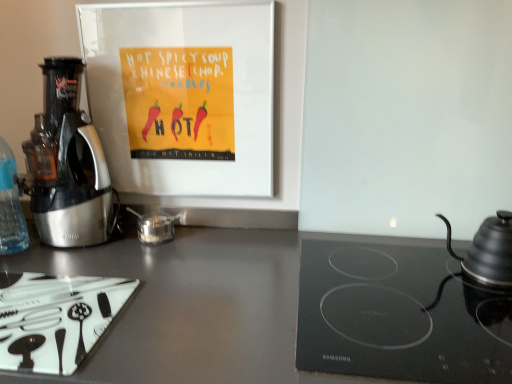
Question: From a real-world perspective, is metallic silver coffee maker at left located higher than white glossy cutting board at lower left, the second kitchen appliance viewed from the right?

Choices:
 (A) no
 (B) yes

Answer: (B)

Question: From the image's perspective, would you say metallic silver coffee maker at left is positioned over white glossy cutting board at lower left, marked as the first kitchen appliance in a left-to-right arrangement?

Choices:
 (A) no
 (B) yes

Answer: (B)

Question: Can you confirm if metallic silver coffee maker at left is positioned to the left of white glossy cutting board at lower left, marked as the first kitchen appliance in a left-to-right arrangement?

Choices:
 (A) no
 (B) yes

Answer: (B)

Question: Is there a large distance between metallic silver coffee maker at left and white glossy cutting board at lower left, the second kitchen appliance viewed from the right?

Choices:
 (A) yes
 (B) no

Answer: (B)

Question: Is the depth of metallic silver coffee maker at left greater than that of white glossy cutting board at lower left, marked as the first kitchen appliance in a left-to-right arrangement?

Choices:
 (A) no
 (B) yes

Answer: (B)

Question: Is metallic silver coffee maker at left wider than white glossy cutting board at lower left, the second kitchen appliance viewed from the right?

Choices:
 (A) yes
 (B) no

Answer: (B)

Question: Is white glossy cutting board at lower left, marked as the first kitchen appliance in a left-to-right arrangement, directly adjacent to transparent plastic bottle at left?

Choices:
 (A) no
 (B) yes

Answer: (A)

Question: Can you confirm if white glossy cutting board at lower left, the second kitchen appliance viewed from the right, is shorter than transparent plastic bottle at left?

Choices:
 (A) yes
 (B) no

Answer: (A)

Question: Does white glossy cutting board at lower left, marked as the first kitchen appliance in a left-to-right arrangement, have a larger size compared to transparent plastic bottle at left?

Choices:
 (A) yes
 (B) no

Answer: (B)

Question: Does white glossy cutting board at lower left, marked as the first kitchen appliance in a left-to-right arrangement, turn towards transparent plastic bottle at left?

Choices:
 (A) no
 (B) yes

Answer: (A)

Question: Is white glossy cutting board at lower left, marked as the first kitchen appliance in a left-to-right arrangement, taller than transparent plastic bottle at left?

Choices:
 (A) no
 (B) yes

Answer: (A)

Question: Does white glossy cutting board at lower left, the second kitchen appliance viewed from the right, lie in front of transparent plastic bottle at left?

Choices:
 (A) no
 (B) yes

Answer: (B)

Question: From a real-world perspective, is transparent plastic bottle at left located higher than metallic silver coffee maker at left?

Choices:
 (A) yes
 (B) no

Answer: (B)